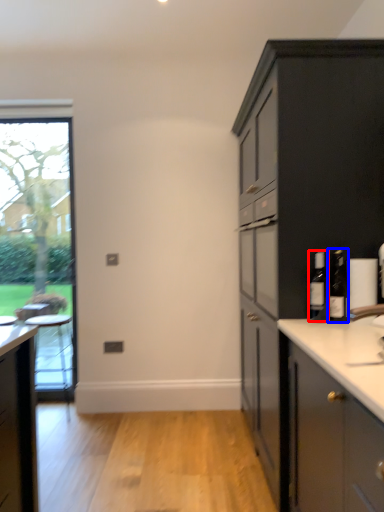
Question: Which object appears closest to the camera in this image, bottle (highlighted by a red box) or bottle (highlighted by a blue box)?

Choices:
 (A) bottle
 (B) bottle

Answer: (B)